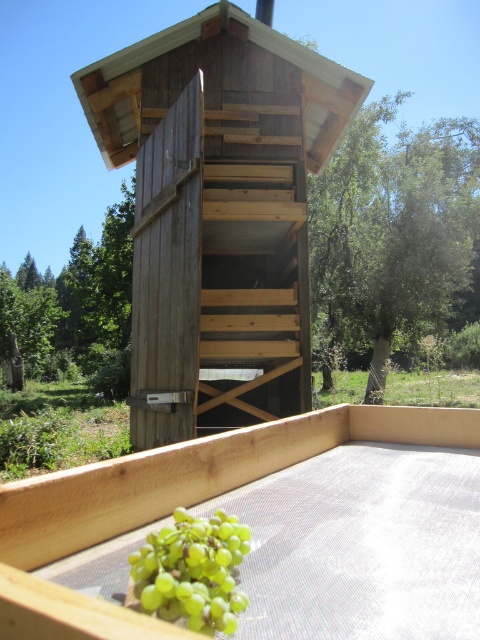
Based on the scene description, what are the coordinates of the wooden hut at center?

The wooden hut at center is located at coordinates point (217, 212).

You are standing in front of the wooden hut at center and want to pick the green matte grapes at lower center. Which direction should you move to reach them?

Since the wooden hut at center is further to the viewer than the green matte grapes at lower center, you should move forward towards the grapes as they are closer to you than the hut.

You are standing in front of the wooden hut at center and want to hang a decoration above the green matte grapes at lower center. Can you reach the spot where the grapes are located without climbing a ladder?

The wooden hut at center is taller than the green matte grapes at lower center. Since the hut is higher, you might need to climb the ladder to reach above the grapes unless the grapes are positioned at a lower height within the hut.